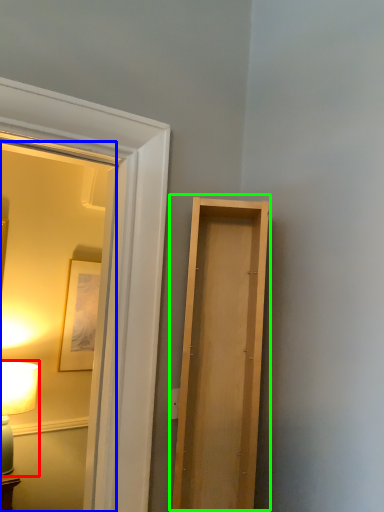
Question: Which is nearer to the table lamp (highlighted by a red box)? mirror (highlighted by a blue box) or door (highlighted by a green box).

Choices:
 (A) mirror
 (B) door

Answer: (A)